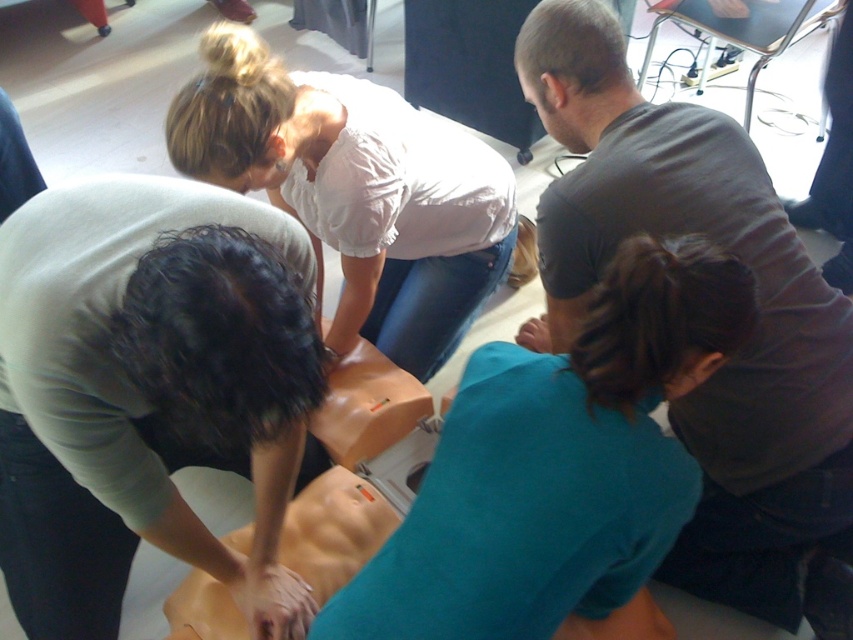
Can you confirm if matte green shirt at center is positioned to the right of dark gray t-shirt at center?

In fact, matte green shirt at center is to the left of dark gray t-shirt at center.

Is matte green shirt at center shorter than dark gray t-shirt at center?

Correct, matte green shirt at center is not as tall as dark gray t-shirt at center.

Who is more distant from viewer, (160, 180) or (751, 404)?

The point (751, 404) is behind.

This screenshot has width=853, height=640. What are the coordinates of `matte green shirt at center` in the screenshot? It's located at (144, 387).

Does teal matte shirt at center have a larger size compared to white cotton shirt at upper center?

Actually, teal matte shirt at center might be smaller than white cotton shirt at upper center.

Which is more to the left, teal matte shirt at center or white cotton shirt at upper center?

Positioned to the left is white cotton shirt at upper center.

Between point (546, 369) and point (390, 276), which one is positioned behind?

The point (390, 276) is more distant.

The height and width of the screenshot is (640, 853). I want to click on teal matte shirt at center, so click(x=556, y=465).

Who is taller, matte green shirt at center or teal matte shirt at center?

With more height is matte green shirt at center.

Can you confirm if matte green shirt at center is thinner than teal matte shirt at center?

Incorrect, matte green shirt at center's width is not less than teal matte shirt at center's.

At what (x,y) coordinates should I click in order to perform the action: click on matte green shirt at center. Please return your answer as a coordinate pair (x, y). This screenshot has height=640, width=853. Looking at the image, I should click on (144, 387).